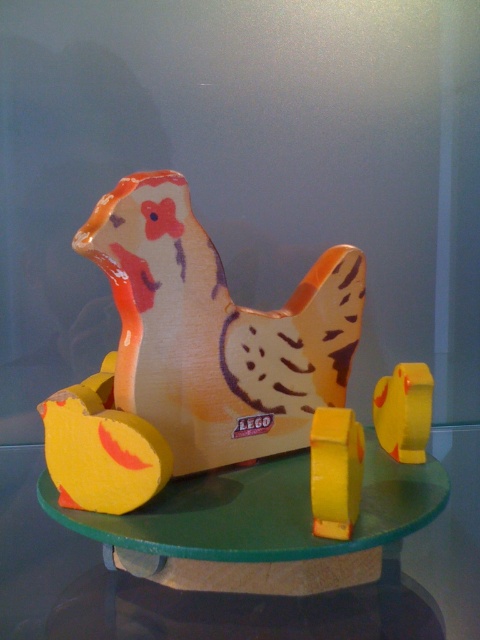
Question: Is wooden chicken at center closer to the viewer compared to green glass table at center?

Choices:
 (A) yes
 (B) no

Answer: (A)

Question: Does green glass table at center have a smaller size compared to yellow matte/soft plastic at center?

Choices:
 (A) no
 (B) yes

Answer: (A)

Question: Which of these objects is positioned closest to the wooden chicken at center?

Choices:
 (A) green glass table at center
 (B) yellow matte/soft plastic at center

Answer: (B)

Question: Is green glass table at center bigger than yellow matte/soft plastic at center?

Choices:
 (A) no
 (B) yes

Answer: (B)

Question: Estimate the real-world distances between objects in this image. Which object is closer to the yellow matte/soft plastic at center?

Choices:
 (A) green glass table at center
 (B) wooden chicken at center

Answer: (A)

Question: Estimate the real-world distances between objects in this image. Which object is farther from the green glass table at center?

Choices:
 (A) wooden chicken at center
 (B) yellow matte/soft plastic at center

Answer: (A)